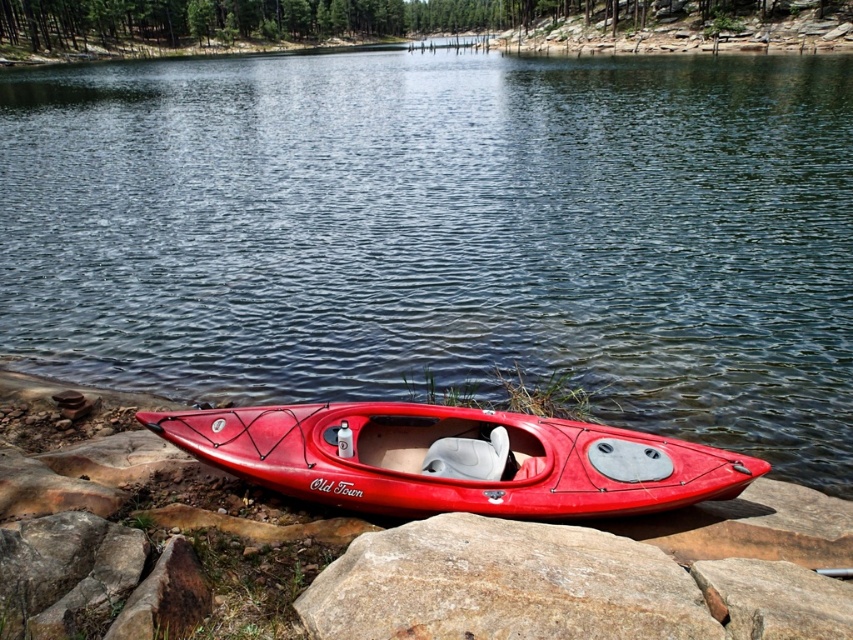
From the picture: You are planning to kayak across the lake and need to know the distance between the clear water at center and the shiny red kayak at lower center. Is it more than 90 feet?

The clear water at center and shiny red kayak at lower center are 90.59 feet apart, so yes, the distance is more than 90 feet.

You are planning to kayak across the lake and need to know if your kayak can fit between the clear water at center and the smooth gray rock at lower center. Can it fit?

The clear water at center is wider than the smooth gray rock at lower center, so the kayak can fit between them.

You are planning to kayak on the lake. Based on the scene, which object takes up more space in the image, the clear water at center or the shiny red kayak at lower center?

The clear water at center is bigger than the shiny red kayak at lower center, so the clear water at center takes up more space in the image.